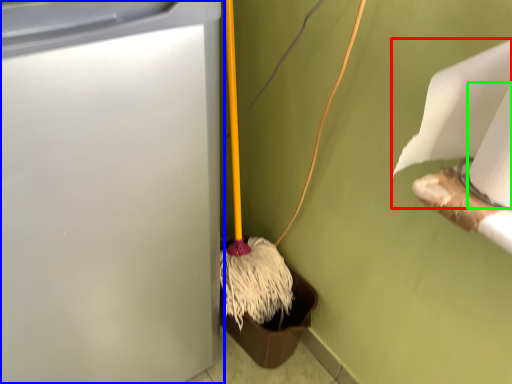
Question: Estimate the real-world distances between objects in this image. Which object is closer to toilet paper (highlighted by a red box), waste container (highlighted by a blue box) or toilet paper (highlighted by a green box)?

Choices:
 (A) waste container
 (B) toilet paper

Answer: (B)